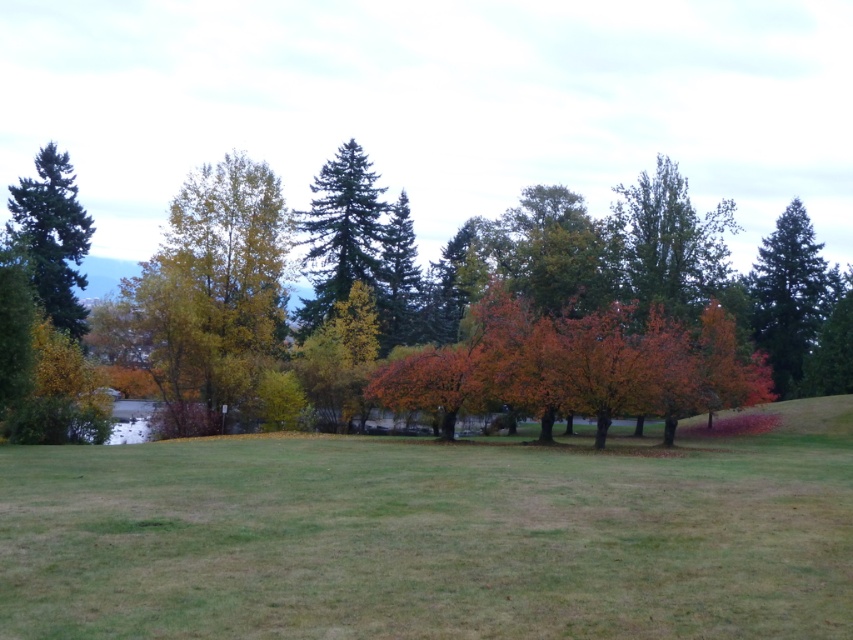
You are standing in the autumn field and want to walk towards the point marked as point [776,269]. There is an obstacle at point [370,227]. Will you encounter this obstacle before reaching your destination?

Yes, because point [370,227] is in front of point [776,269], so you will encounter the obstacle at point [370,227] before reaching your destination.

You are standing in the grassy field and want to take a photo of the autumn leaves tree at center. Based on its position, which direction should you face to ensure it is centered in your camera view?

The autumn leaves tree at center is located at point coordinates, so you should face directly towards the coordinates to center it in your camera view.